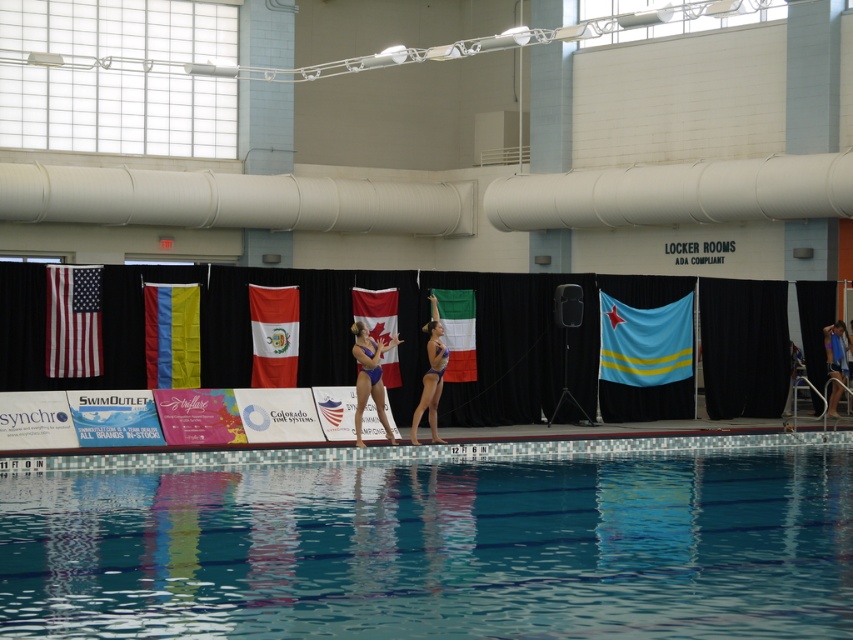
Does blue fabric flag at center appear on the left side of blue glossy bikini at center?

In fact, blue fabric flag at center is to the right of blue glossy bikini at center.

Can you confirm if blue fabric flag at center is shorter than blue glossy bikini at center?

Yes.

Find the location of a particular element. blue fabric flag at center is located at coordinates (645, 340).

Can you confirm if blue fabric flag at center is bigger than american flag at left?

Correct, blue fabric flag at center is larger in size than american flag at left.

Describe the element at coordinates (645, 340) in the screenshot. This screenshot has height=640, width=853. I see `blue fabric flag at center` at that location.

Image resolution: width=853 pixels, height=640 pixels. Find the location of `blue fabric flag at center`. blue fabric flag at center is located at coordinates (645, 340).

Which is more to the left, transparent glass pool at center or blue glossy bikini at center?

Positioned to the left is transparent glass pool at center.

Does transparent glass pool at center appear under blue glossy bikini at center?

Yes, transparent glass pool at center is below blue glossy bikini at center.

At what (x,y) coordinates should I click in order to perform the action: click on transparent glass pool at center. Please return your answer as a coordinate pair (x, y). Looking at the image, I should click on (437, 541).